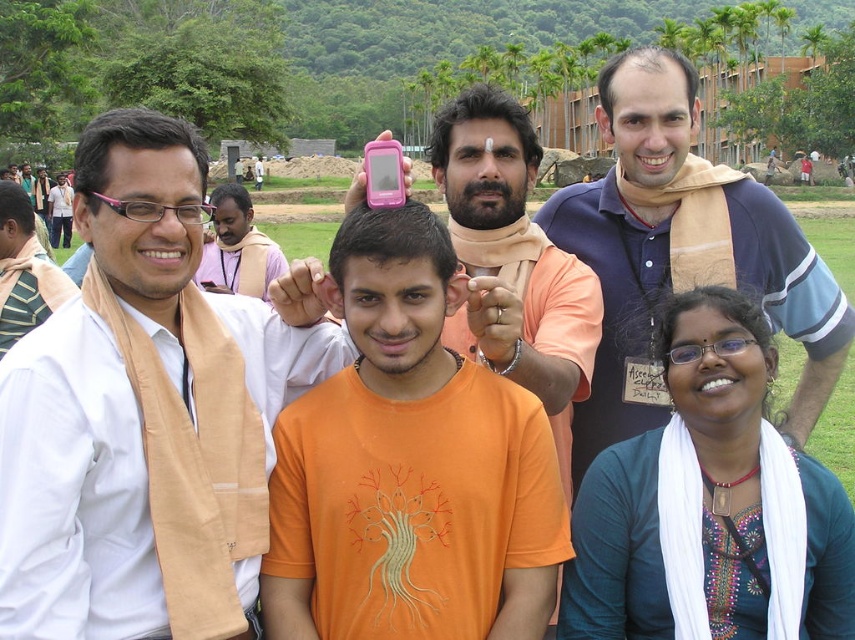
Question: Does white cotton shirt at left have a smaller size compared to blue cotton shirt at upper right?

Choices:
 (A) yes
 (B) no

Answer: (A)

Question: Is white cotton shirt at left wider than white fabric scarf at lower right?

Choices:
 (A) yes
 (B) no

Answer: (A)

Question: Which of the following is the farthest from the observer?

Choices:
 (A) white cotton shirt at left
 (B) orange cotton t-shirt at center
 (C) blue cotton shirt at upper right

Answer: (C)

Question: Is white cotton shirt at left closer to the viewer compared to white fabric scarf at lower right?

Choices:
 (A) no
 (B) yes

Answer: (B)

Question: Among these points, which one is nearest to the camera?

Choices:
 (A) (611, 506)
 (B) (223, 394)
 (C) (638, 262)
 (D) (342, 529)

Answer: (A)

Question: Which of the following is the farthest from the observer?

Choices:
 (A) blue cotton shirt at upper right
 (B) white fabric scarf at lower right

Answer: (A)